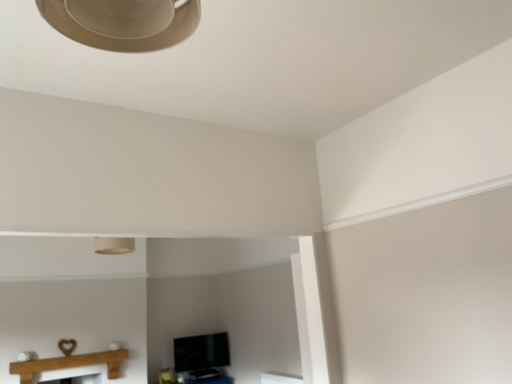
Where is `wooden mantle at lower left`? wooden mantle at lower left is located at coordinates (70, 364).

The image size is (512, 384). What do you see at coordinates (70, 364) in the screenshot?
I see `wooden mantle at lower left` at bounding box center [70, 364].

The height and width of the screenshot is (384, 512). What do you see at coordinates (114, 245) in the screenshot?
I see `matte beige lampshade at upper center` at bounding box center [114, 245].

Where is `matte beige lampshade at upper center`? Image resolution: width=512 pixels, height=384 pixels. matte beige lampshade at upper center is located at coordinates (114, 245).

Locate an element on the screen. This screenshot has width=512, height=384. wooden mantle at lower left is located at coordinates (70, 364).

Which object is positioned more to the left, wooden mantle at lower left or matte beige lampshade at upper center?

Positioned to the left is wooden mantle at lower left.

In the scene shown: Is wooden mantle at lower left positioned behind matte beige lampshade at upper center?

Yes, it is.

Does point (28, 380) lie behind point (120, 243)?

That is True.

From the image's perspective, is wooden mantle at lower left positioned above or below matte beige lampshade at upper center?

wooden mantle at lower left is situated lower than matte beige lampshade at upper center in the image.

From a real-world perspective, is wooden mantle at lower left above or below matte beige lampshade at upper center?

wooden mantle at lower left is below matte beige lampshade at upper center.

Is wooden mantle at lower left thinner than matte beige lampshade at upper center?

Yes.

Considering the sizes of objects wooden mantle at lower left and matte beige lampshade at upper center in the image provided, who is shorter, wooden mantle at lower left or matte beige lampshade at upper center?

matte beige lampshade at upper center.

Is wooden mantle at lower left bigger than matte beige lampshade at upper center?

Correct, wooden mantle at lower left is larger in size than matte beige lampshade at upper center.

Is wooden mantle at lower left outside of matte beige lampshade at upper center?

Indeed, wooden mantle at lower left is completely outside matte beige lampshade at upper center.

Is wooden mantle at lower left in contact with matte beige lampshade at upper center?

There is a gap between wooden mantle at lower left and matte beige lampshade at upper center.

Is wooden mantle at lower left looking in the opposite direction of matte beige lampshade at upper center?

wooden mantle at lower left does not have its back to matte beige lampshade at upper center.

How many degrees apart are the facing directions of wooden mantle at lower left and matte beige lampshade at upper center?

The angle between the facing direction of wooden mantle at lower left and the facing direction of matte beige lampshade at upper center is 0.244 degrees.

There is a wooden mantle at lower left. Where is `lamp above it (from a real-world perspective)`? lamp above it (from a real-world perspective) is located at coordinates (114, 245).

Considering the positions of objects matte beige lampshade at upper center and wooden mantle at lower left in the image provided, who is more to the right, matte beige lampshade at upper center or wooden mantle at lower left?

matte beige lampshade at upper center is more to the right.

Considering the positions of objects matte beige lampshade at upper center and wooden mantle at lower left in the image provided, who is in front, matte beige lampshade at upper center or wooden mantle at lower left?

Positioned in front is matte beige lampshade at upper center.

Which point is more distant from viewer, (106, 252) or (119, 358)?

The point (119, 358) is behind.

From the image's perspective, which is below, matte beige lampshade at upper center or wooden mantle at lower left?

wooden mantle at lower left, from the image's perspective.

From a real-world perspective, is matte beige lampshade at upper center physically located above or below wooden mantle at lower left?

matte beige lampshade at upper center is situated higher than wooden mantle at lower left in the real world.

Considering the sizes of objects matte beige lampshade at upper center and wooden mantle at lower left in the image provided, who is thinner, matte beige lampshade at upper center or wooden mantle at lower left?

wooden mantle at lower left.

Is matte beige lampshade at upper center taller or shorter than wooden mantle at lower left?

Clearly, matte beige lampshade at upper center is shorter compared to wooden mantle at lower left.

Who is bigger, matte beige lampshade at upper center or wooden mantle at lower left?

With larger size is wooden mantle at lower left.

Which is correct: matte beige lampshade at upper center is inside wooden mantle at lower left, or outside of it?

matte beige lampshade at upper center is located beyond the bounds of wooden mantle at lower left.

Would you say matte beige lampshade at upper center is a long distance from wooden mantle at lower left?

Indeed, matte beige lampshade at upper center is not near wooden mantle at lower left.

Is matte beige lampshade at upper center aimed at wooden mantle at lower left?

No, matte beige lampshade at upper center is not facing towards wooden mantle at lower left.

In the scene shown: How many degrees apart are the facing directions of matte beige lampshade at upper center and wooden mantle at lower left?

The angular difference between matte beige lampshade at upper center and wooden mantle at lower left is 0.244 degrees.

How distant is matte beige lampshade at upper center from wooden mantle at lower left?

A distance of 1.78 meters exists between matte beige lampshade at upper center and wooden mantle at lower left.

This screenshot has height=384, width=512. What are the coordinates of `lamp above the wooden mantle at lower left (from the image's perspective)` in the screenshot? It's located at (114, 245).

Locate an element on the screen. The width and height of the screenshot is (512, 384). table on the left of matte beige lampshade at upper center is located at coordinates (70, 364).

The image size is (512, 384). In order to click on lamp lying above the wooden mantle at lower left (from the image's perspective) in this screenshot , I will do `click(114, 245)`.